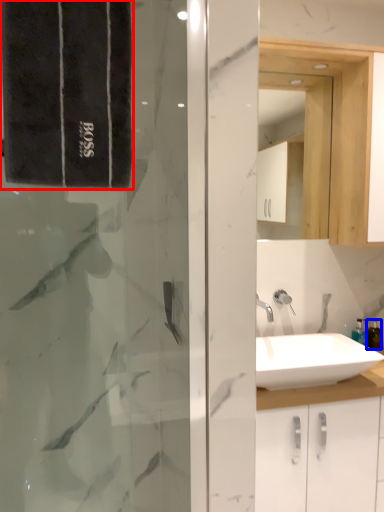
Question: Which point is closer to the camera, bath towel (highlighted by a red box) or toiletry (highlighted by a blue box)?

Choices:
 (A) bath towel
 (B) toiletry

Answer: (A)